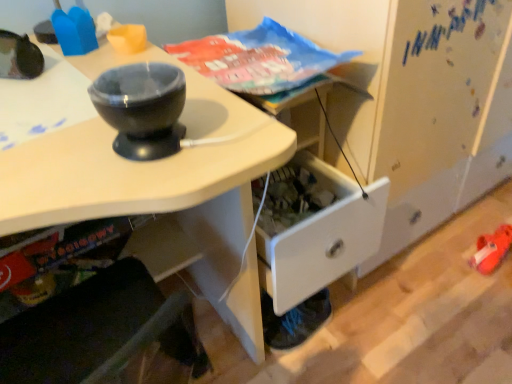
Question: From a real-world perspective, is white glossy desk at center on top of blue fabric shoe at lower right?

Choices:
 (A) yes
 (B) no

Answer: (A)

Question: From the image's perspective, is white glossy desk at center on top of blue fabric shoe at lower right?

Choices:
 (A) yes
 (B) no

Answer: (A)

Question: Is white glossy desk at center thinner than blue fabric shoe at lower right?

Choices:
 (A) yes
 (B) no

Answer: (B)

Question: Is white glossy desk at center bigger than blue fabric shoe at lower right?

Choices:
 (A) yes
 (B) no

Answer: (A)

Question: Could blue fabric shoe at lower right be considered to be inside white glossy desk at center?

Choices:
 (A) yes
 (B) no

Answer: (B)

Question: Considering the relative positions of white glossy desk at center and blue fabric shoe at lower right in the image provided, is white glossy desk at center in front of blue fabric shoe at lower right?

Choices:
 (A) yes
 (B) no

Answer: (A)

Question: Is blue fabric shoe at lower right positioned with its back to white glossy desk at center?

Choices:
 (A) no
 (B) yes

Answer: (A)

Question: Can you confirm if blue fabric shoe at lower right is bigger than white glossy desk at center?

Choices:
 (A) yes
 (B) no

Answer: (B)

Question: Considering the relative positions of blue fabric shoe at lower right and white glossy desk at center in the image provided, is blue fabric shoe at lower right to the left of white glossy desk at center from the viewer's perspective?

Choices:
 (A) yes
 (B) no

Answer: (B)

Question: Can you confirm if blue fabric shoe at lower right is taller than white glossy desk at center?

Choices:
 (A) no
 (B) yes

Answer: (A)

Question: From the image's perspective, is blue fabric shoe at lower right located above white glossy desk at center?

Choices:
 (A) no
 (B) yes

Answer: (A)

Question: Considering the relative positions of blue fabric shoe at lower right and white glossy desk at center in the image provided, is blue fabric shoe at lower right to the right of white glossy desk at center from the viewer's perspective?

Choices:
 (A) no
 (B) yes

Answer: (B)

Question: Based on their sizes in the image, would you say blue fabric shoe at lower right is bigger or smaller than white glossy desk at center?

Choices:
 (A) big
 (B) small

Answer: (B)